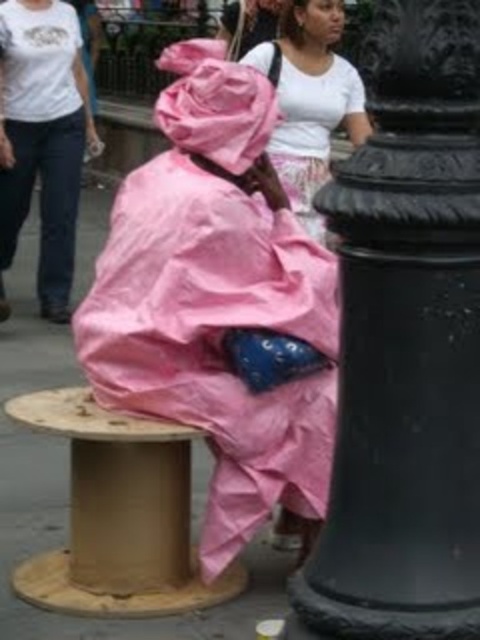
You are standing at the location of the camera in the scene. You want to pick up the pink plastic bag at center. Can you reach it without moving your feet?

The pink plastic bag at center and camera are 3.78 meters apart from each other. Since the distance is greater than an average person can reach, you cannot reach the pink plastic bag at center without moving your feet.